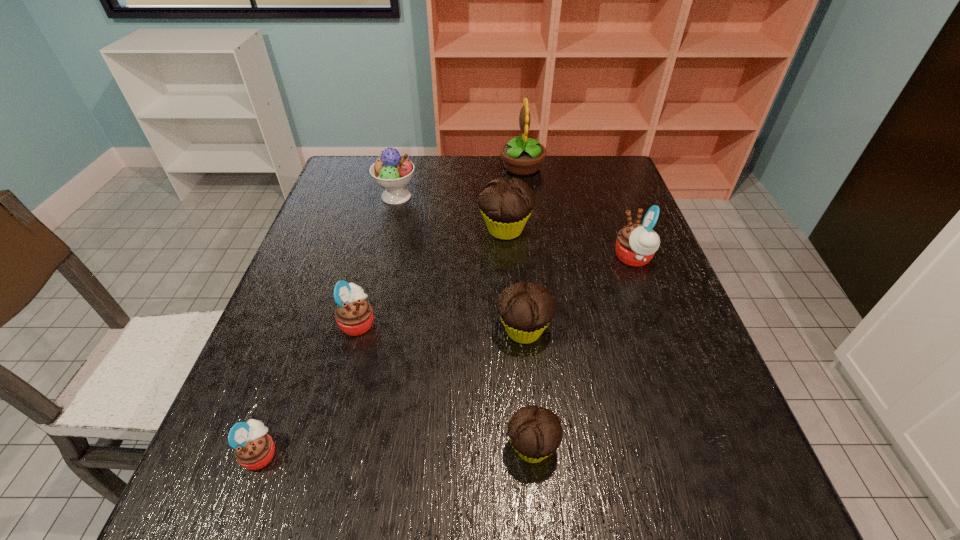
Find the location of a particular element. The height and width of the screenshot is (540, 960). the leftmost muffin is located at coordinates (254, 449).

What are the coordinates of `the smallest chocolate muffin` in the screenshot? It's located at (535, 433).

Locate an element on the screen. The image size is (960, 540). vacant space located on the face of the yellow sunflower is located at coordinates (400, 167).

You are a GUI agent. You are given a task and a screenshot of the screen. Output one action in this format:
    pyautogui.click(x=<x>, y=<y>)
    Task: Click on the free space located on the face of the yellow sunflower
    
    Given the screenshot: What is the action you would take?
    point(428,167)

The height and width of the screenshot is (540, 960). I want to click on vacant space located on the face of the yellow sunflower, so click(447, 167).

Locate an element on the screen. free space located on the right of the second farthest object is located at coordinates (485, 196).

The width and height of the screenshot is (960, 540). I want to click on blank space located on the front-facing side of the rightmost pink muffin, so click(554, 258).

This screenshot has height=540, width=960. Identify the location of free location located on the front-facing side of the rightmost pink muffin. (565, 258).

Locate an element on the screen. The image size is (960, 540). vacant space located on the front-facing side of the rightmost pink muffin is located at coordinates (498, 258).

This screenshot has height=540, width=960. I want to click on vacant space positioned on the front of the farthest chocolate muffin, so click(515, 370).